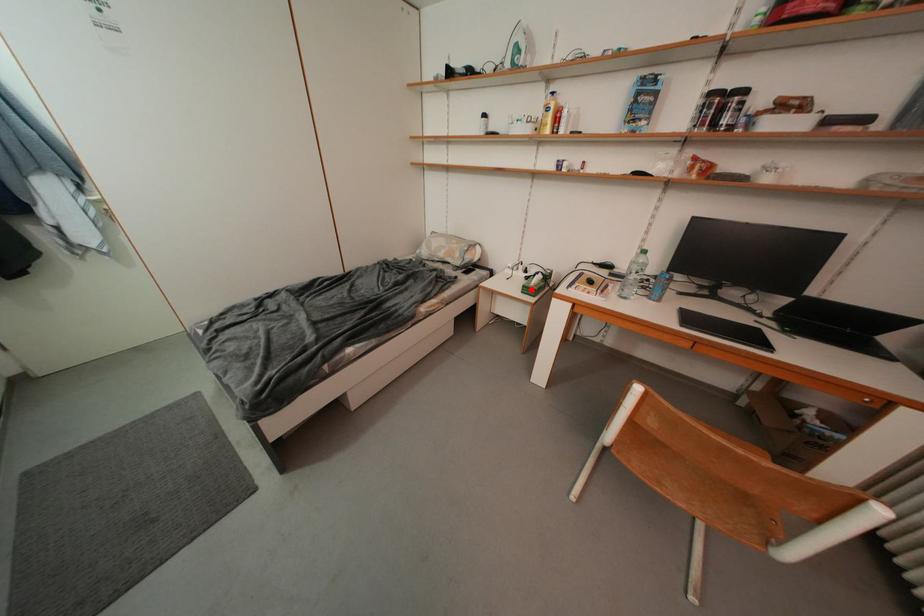
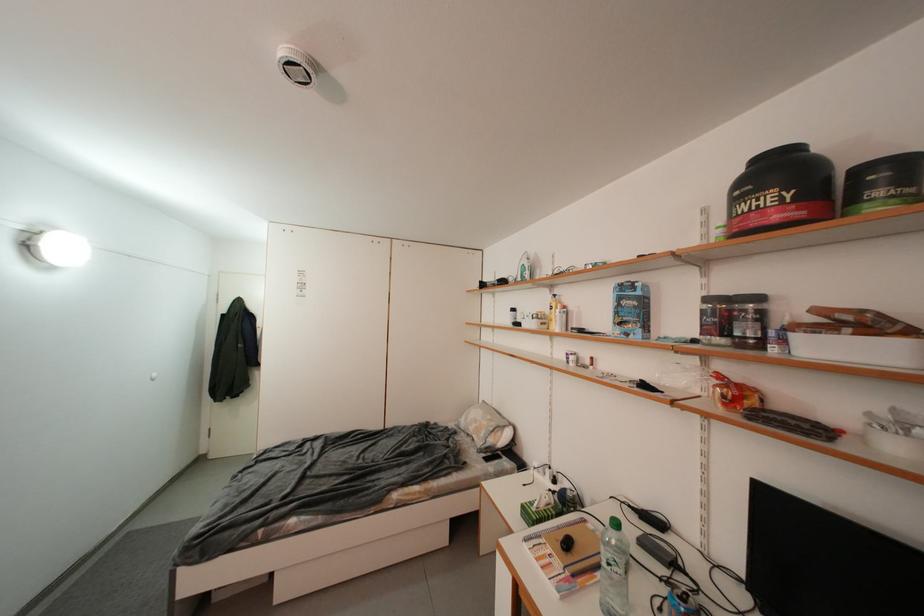
Question: I am providing you with two images of the same scene from different viewpoints. A red point is shown in image1. For the corresponding object point in image2, is it positioned nearer or farther from the camera?

Choices:
 (A) Nearer
 (B) Farther

Answer: (A)